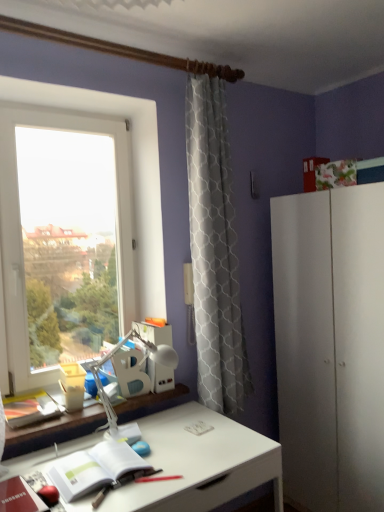
Question: From a real-world perspective, is white paper notebook at lower left over white plastic table lamp at center?

Choices:
 (A) yes
 (B) no

Answer: (B)

Question: Does white paper notebook at lower left have a greater height compared to white plastic table lamp at center?

Choices:
 (A) no
 (B) yes

Answer: (A)

Question: Can you confirm if white paper notebook at lower left is smaller than white plastic table lamp at center?

Choices:
 (A) yes
 (B) no

Answer: (A)

Question: Is white paper notebook at lower left closer to the viewer compared to white plastic table lamp at center?

Choices:
 (A) yes
 (B) no

Answer: (A)

Question: Is white paper notebook at lower left to the right of white plastic table lamp at center from the viewer's perspective?

Choices:
 (A) no
 (B) yes

Answer: (A)

Question: Does white paper notebook at lower left turn towards white plastic table lamp at center?

Choices:
 (A) no
 (B) yes

Answer: (A)

Question: Is white plastic table lamp at center located within white glossy desk at center?

Choices:
 (A) no
 (B) yes

Answer: (A)

Question: Could you tell me if white glossy desk at center is turned towards white plastic table lamp at center?

Choices:
 (A) yes
 (B) no

Answer: (B)

Question: Is white glossy desk at center wider than white plastic table lamp at center?

Choices:
 (A) no
 (B) yes

Answer: (B)

Question: From the image's perspective, is white glossy desk at center under white plastic table lamp at center?

Choices:
 (A) no
 (B) yes

Answer: (B)

Question: Is white glossy desk at center turned away from white plastic table lamp at center?

Choices:
 (A) no
 (B) yes

Answer: (A)

Question: Considering the relative positions of white glossy desk at center and white plastic table lamp at center in the image provided, is white glossy desk at center to the left of white plastic table lamp at center from the viewer's perspective?

Choices:
 (A) yes
 (B) no

Answer: (B)

Question: Considering the relative sizes of white paper notebook at lower left and transparent glass window at left in the image provided, is white paper notebook at lower left bigger than transparent glass window at left?

Choices:
 (A) yes
 (B) no

Answer: (B)